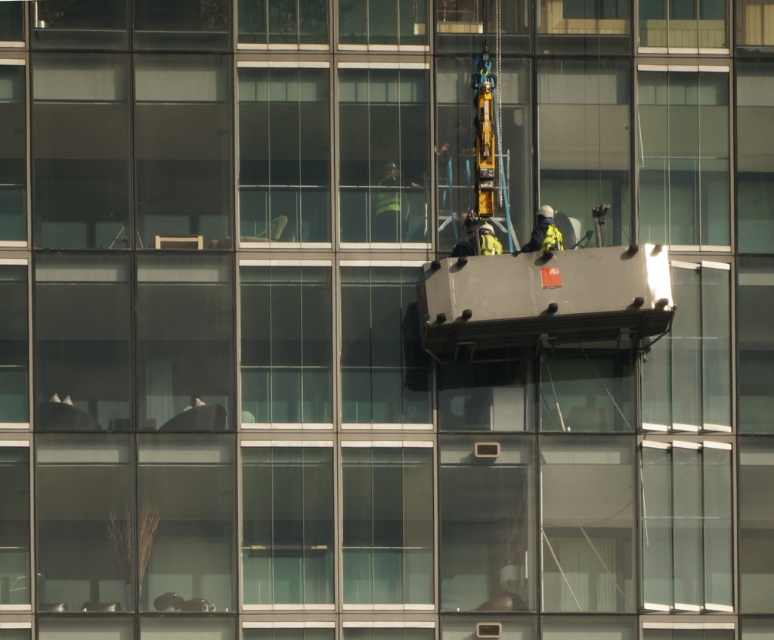
You are a safety inspector looking at the image of the building. You notice the reflective silver helmet at center and the yellow reflective vest at center. According to safety protocols, the helmet must be worn on top of the vest. Is this requirement being followed in the image?

The reflective silver helmet at center is above the yellow reflective vest at center, so the helmet is positioned correctly on top of the vest as required by safety protocols.

You are a safety inspector checking the distance between two workers on the suspended platform. The platform is 36 inches wide. The workers are wearing a reflective silver helmet at center and a yellow reflective vest at center. Can both workers stand on the platform without overlapping each other?

The distance between the reflective silver helmet at center and yellow reflective vest at center is 29.41 inches. Since the platform is 36 inches wide, there is enough space for both workers to stand without overlapping as 29.41 inches is less than the platform width of 36 inches.

You are a safety inspector checking the construction site. You notice two items at the center of the image. What is the position of the reflective silver helmet at center relative to the yellow reflective vest at center?

The reflective silver helmet at center is positioned to the left of the yellow reflective vest at center.